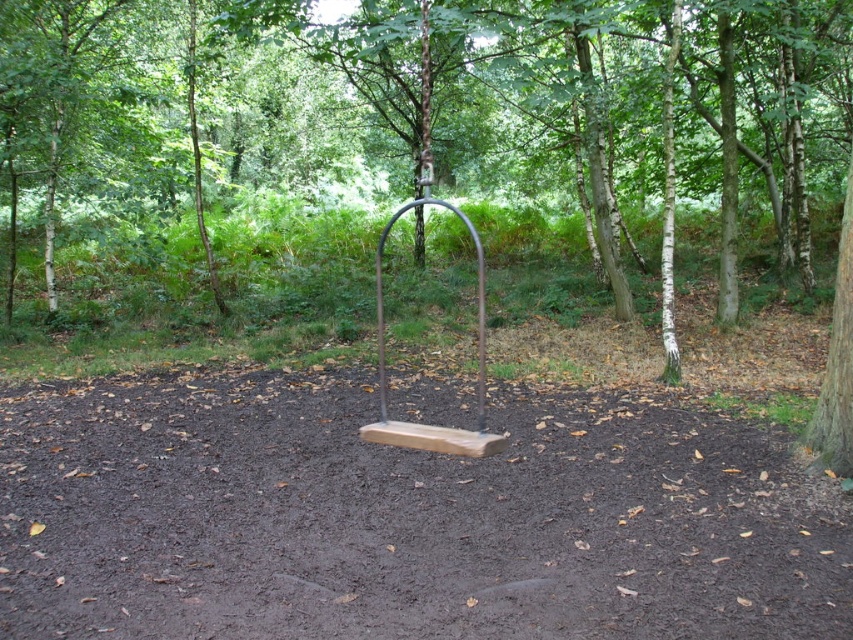
Is brown wood tree at center shorter than brown wooden swing at center?

In fact, brown wood tree at center may be taller than brown wooden swing at center.

Locate an element on the screen. The image size is (853, 640). brown wood tree at center is located at coordinates pos(413,164).